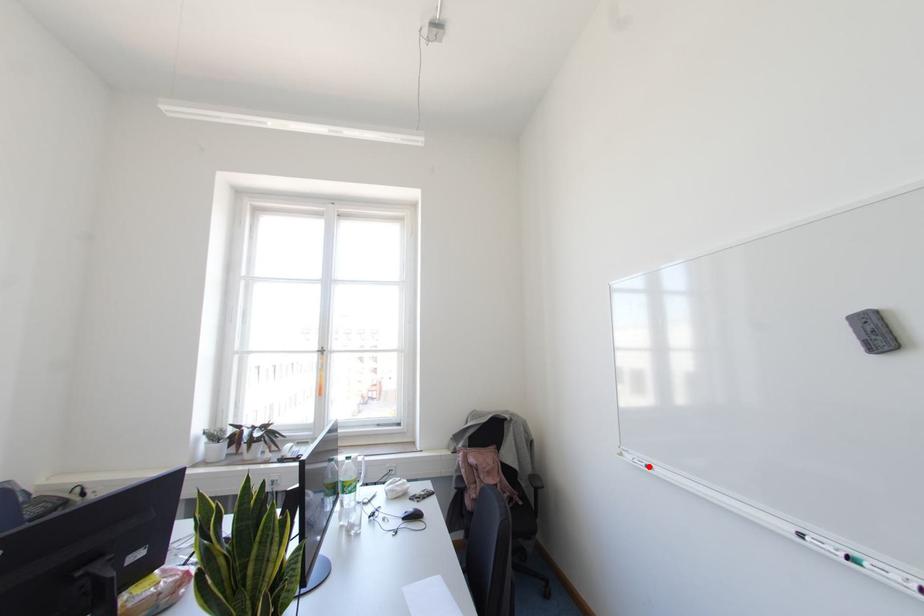
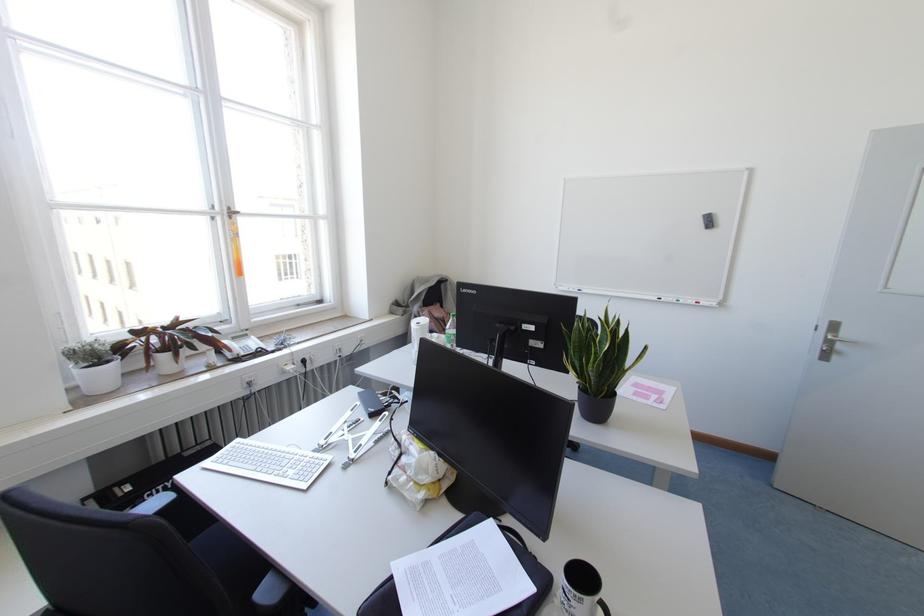
Find the pixel in the second image that matches the highlighted location in the first image.

(578, 290)